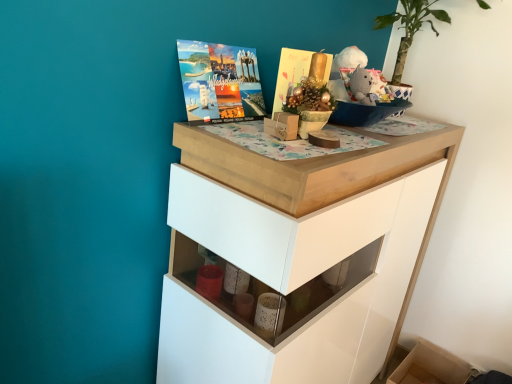
Question: From the image's perspective, is matte brown box at center above knitted gray bear at upper right?

Choices:
 (A) no
 (B) yes

Answer: (A)

Question: Is matte brown box at center turned away from knitted gray bear at upper right?

Choices:
 (A) yes
 (B) no

Answer: (B)

Question: Does matte brown box at center have a greater width compared to knitted gray bear at upper right?

Choices:
 (A) yes
 (B) no

Answer: (A)

Question: Is matte brown box at center aimed at knitted gray bear at upper right?

Choices:
 (A) no
 (B) yes

Answer: (A)

Question: Would you say matte brown box at center is outside knitted gray bear at upper right?

Choices:
 (A) no
 (B) yes

Answer: (B)

Question: Considering the positions of white glossy chest of drawers at upper center and matte brown box at center in the image, is white glossy chest of drawers at upper center wider or thinner than matte brown box at center?

Choices:
 (A) wide
 (B) thin

Answer: (A)

Question: From their relative heights in the image, would you say white glossy chest of drawers at upper center is taller or shorter than matte brown box at center?

Choices:
 (A) short
 (B) tall

Answer: (B)

Question: From a real-world perspective, relative to matte brown box at center, is white glossy chest of drawers at upper center vertically above or below?

Choices:
 (A) below
 (B) above

Answer: (A)

Question: Is white glossy chest of drawers at upper center bigger or smaller than matte brown box at center?

Choices:
 (A) big
 (B) small

Answer: (A)

Question: Is bare wood drawer at lower right bigger or smaller than white glossy chest of drawers at upper center?

Choices:
 (A) big
 (B) small

Answer: (B)

Question: Choose the correct answer: Is bare wood drawer at lower right inside white glossy chest of drawers at upper center or outside it?

Choices:
 (A) inside
 (B) outside

Answer: (B)

Question: From the image's perspective, is bare wood drawer at lower right positioned above or below white glossy chest of drawers at upper center?

Choices:
 (A) above
 (B) below

Answer: (B)

Question: In terms of width, does bare wood drawer at lower right look wider or thinner when compared to white glossy chest of drawers at upper center?

Choices:
 (A) thin
 (B) wide

Answer: (A)

Question: Considering the positions of bare wood drawer at lower right and matte brown box at center in the image, is bare wood drawer at lower right taller or shorter than matte brown box at center?

Choices:
 (A) short
 (B) tall

Answer: (B)

Question: Does point (415, 377) appear closer or farther from the camera than point (284, 117)?

Choices:
 (A) closer
 (B) farther

Answer: (B)